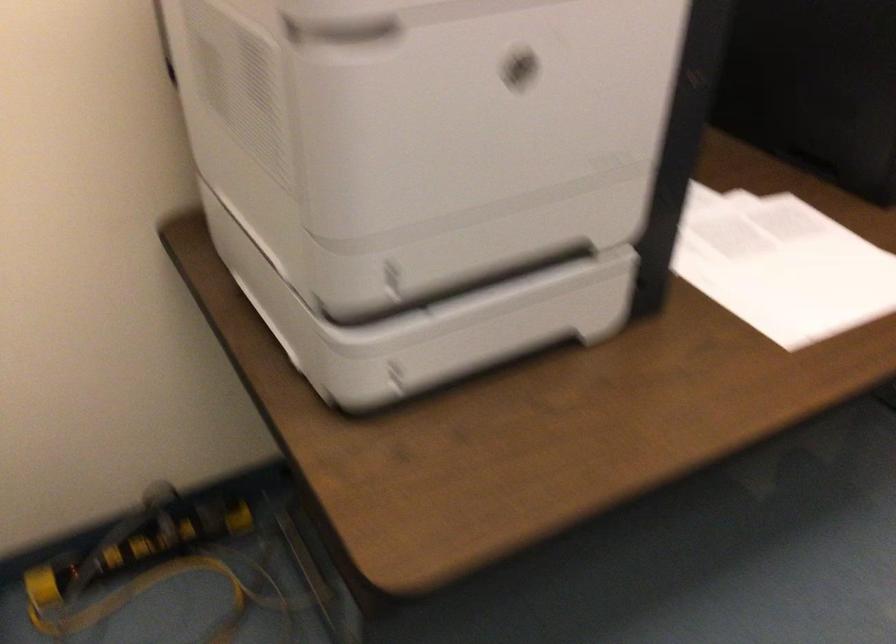
Where would you get the document paper? Please return your answer as a coordinate pair (x, y).

(811, 263)